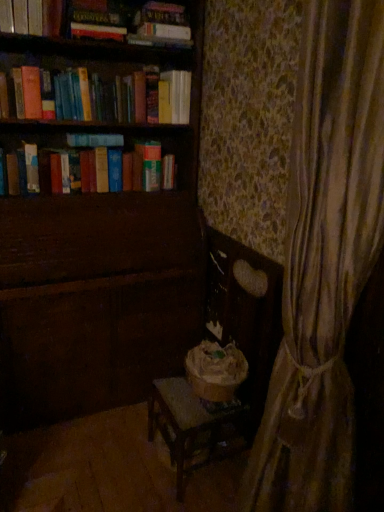
Question: Is hardcover book at upper center, marked as the 1th paperback book in a top-to-bottom arrangement, facing towards wooden rocking chair at center?

Choices:
 (A) no
 (B) yes

Answer: (A)

Question: Does hardcover book at upper center, which ranks as the 3th paperback book in left-to-right order, have a larger size compared to wooden rocking chair at center?

Choices:
 (A) no
 (B) yes

Answer: (A)

Question: Is hardcover book at upper center, which ranks as the 3th paperback book in left-to-right order, next to wooden rocking chair at center and touching it?

Choices:
 (A) yes
 (B) no

Answer: (B)

Question: Is wooden rocking chair at center at the back of hardcover book at upper center, the 3th paperback book when ordered from bottom to top?

Choices:
 (A) yes
 (B) no

Answer: (B)

Question: Considering the relative sizes of hardcover book at upper center, the 3th paperback book when ordered from bottom to top, and wooden rocking chair at center in the image provided, is hardcover book at upper center, the 3th paperback book when ordered from bottom to top, smaller than wooden rocking chair at center?

Choices:
 (A) no
 (B) yes

Answer: (B)

Question: Can you confirm if hardcover book at upper center, the 1th paperback book in the right-to-left sequence, is thinner than wooden rocking chair at center?

Choices:
 (A) no
 (B) yes

Answer: (B)

Question: Considering the relative sizes of hardcover book at upper left and hardcover book at upper center, the 3th paperback book when ordered from bottom to top, in the image provided, is hardcover book at upper left smaller than hardcover book at upper center, the 3th paperback book when ordered from bottom to top,?

Choices:
 (A) yes
 (B) no

Answer: (B)

Question: Considering the relative sizes of hardcover book at upper left and hardcover book at upper center, marked as the 1th paperback book in a top-to-bottom arrangement, in the image provided, is hardcover book at upper left taller than hardcover book at upper center, marked as the 1th paperback book in a top-to-bottom arrangement,?

Choices:
 (A) no
 (B) yes

Answer: (B)

Question: Are hardcover book at upper left and hardcover book at upper center, which ranks as the 3th paperback book in left-to-right order, making contact?

Choices:
 (A) no
 (B) yes

Answer: (A)

Question: Considering the relative positions of hardcover book at upper left and hardcover book at upper center, marked as the 1th paperback book in a top-to-bottom arrangement, in the image provided, is hardcover book at upper left behind hardcover book at upper center, marked as the 1th paperback book in a top-to-bottom arrangement,?

Choices:
 (A) yes
 (B) no

Answer: (B)

Question: Considering the relative sizes of hardcover book at upper left and hardcover book at upper center, the 1th paperback book in the right-to-left sequence, in the image provided, is hardcover book at upper left thinner than hardcover book at upper center, the 1th paperback book in the right-to-left sequence,?

Choices:
 (A) no
 (B) yes

Answer: (A)

Question: Is hardcover book at upper left in front of hardcover book at upper center, the 1th paperback book in the right-to-left sequence?

Choices:
 (A) no
 (B) yes

Answer: (B)

Question: Is wooden rocking chair at center positioned in front of hardcover book at upper center, the 2th paperback book in the left-to-right sequence?

Choices:
 (A) yes
 (B) no

Answer: (A)